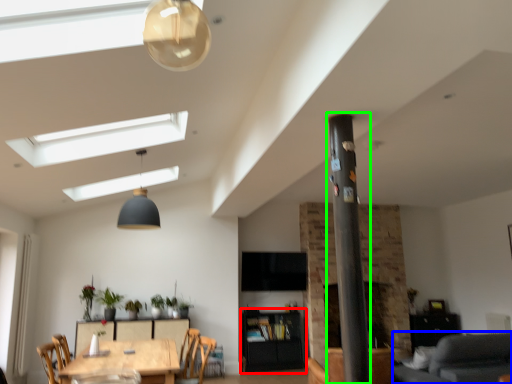
Question: Based on their relative distances, which object is farther from cabinetry (highlighted by a red box)? Choose from couch (highlighted by a blue box) and pillar (highlighted by a green box).

Choices:
 (A) couch
 (B) pillar

Answer: (B)